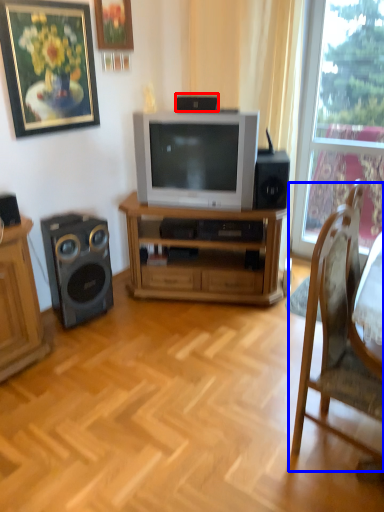
Question: Which of the following is the closest to the observer, speaker (highlighted by a red box) or chair (highlighted by a blue box)?

Choices:
 (A) speaker
 (B) chair

Answer: (B)